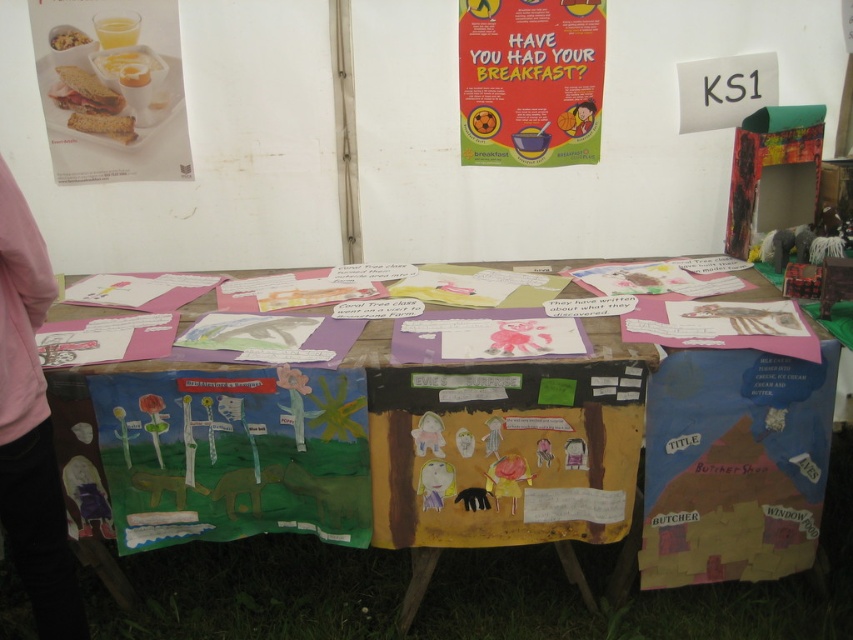
Question: Which is nearer to the wooden table at center?

Choices:
 (A) matte plastic bowl at upper left
 (B) matte plastic food at upper left

Answer: (B)

Question: Is pink fabric at left below matte white toast at upper left?

Choices:
 (A) yes
 (B) no

Answer: (A)

Question: In this image, where is matte plastic food at upper left located relative to pink fabric at left?

Choices:
 (A) below
 (B) above

Answer: (B)

Question: Which point appears farthest from the camera in this image?

Choices:
 (A) (125, 22)
 (B) (84, 35)

Answer: (B)

Question: Which of the following is the farthest from the observer?

Choices:
 (A) (842, 422)
 (B) (21, 416)

Answer: (A)

Question: Considering the relative positions of red paper poster at upper center and matte white toast at upper left in the image provided, where is red paper poster at upper center located with respect to matte white toast at upper left?

Choices:
 (A) above
 (B) below

Answer: (A)